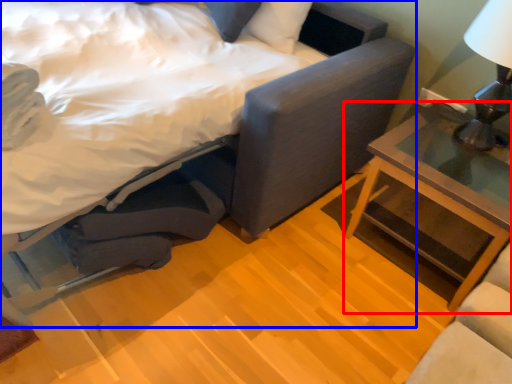
Question: Which object appears closest to the camera in this image, nightstand (highlighted by a red box) or bed (highlighted by a blue box)?

Choices:
 (A) nightstand
 (B) bed

Answer: (B)